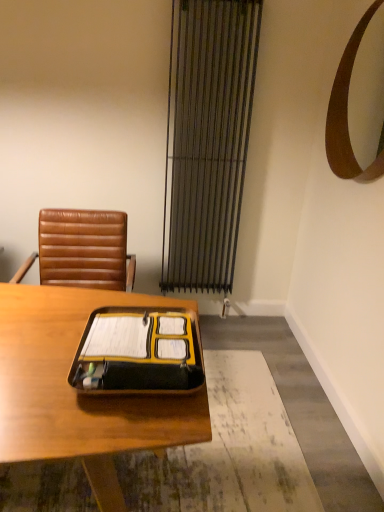
Question: Is brown leather chair at upper left looking in the opposite direction of metallic silver curtain at center?

Choices:
 (A) yes
 (B) no

Answer: (B)

Question: Does brown leather chair at upper left appear on the left side of metallic silver curtain at center?

Choices:
 (A) yes
 (B) no

Answer: (A)

Question: Does brown leather chair at upper left have a greater height compared to metallic silver curtain at center?

Choices:
 (A) yes
 (B) no

Answer: (B)

Question: Is brown leather chair at upper left in contact with metallic silver curtain at center?

Choices:
 (A) no
 (B) yes

Answer: (A)

Question: From a real-world perspective, is brown leather chair at upper left below metallic silver curtain at center?

Choices:
 (A) no
 (B) yes

Answer: (B)

Question: Can you confirm if brown leather chair at upper left is positioned to the right of metallic silver curtain at center?

Choices:
 (A) yes
 (B) no

Answer: (B)

Question: Is wooden desk at center aimed at brown leather chair at upper left?

Choices:
 (A) no
 (B) yes

Answer: (A)

Question: Is brown leather chair at upper left completely or partially inside wooden desk at center?

Choices:
 (A) yes
 (B) no

Answer: (B)

Question: From a real-world perspective, is wooden desk at center under brown leather chair at upper left?

Choices:
 (A) no
 (B) yes

Answer: (B)

Question: From the image's perspective, is wooden desk at center above brown leather chair at upper left?

Choices:
 (A) yes
 (B) no

Answer: (B)

Question: Can you confirm if wooden desk at center is shorter than brown leather chair at upper left?

Choices:
 (A) no
 (B) yes

Answer: (A)

Question: Is the position of wooden desk at center more distant than that of brown leather chair at upper left?

Choices:
 (A) yes
 (B) no

Answer: (B)

Question: Can you confirm if yellow matte folder at center is positioned to the right of wooden desk at center?

Choices:
 (A) no
 (B) yes

Answer: (B)